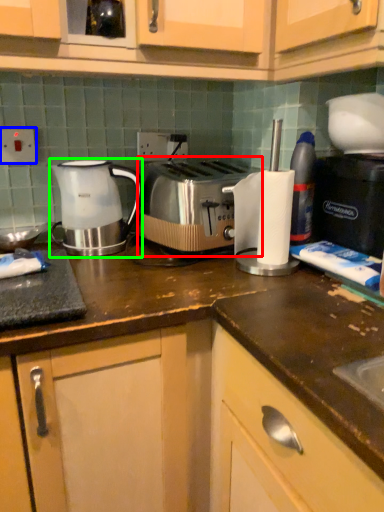
Question: Which object is the farthest from toaster (highlighted by a red box)? Choose among these: electric outlet (highlighted by a blue box) or kettle (highlighted by a green box).

Choices:
 (A) electric outlet
 (B) kettle

Answer: (A)